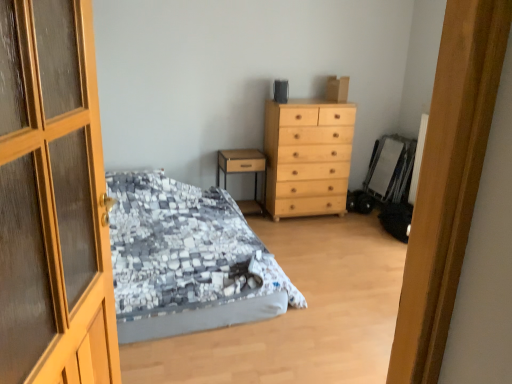
Where is `textured gray bed at center`? textured gray bed at center is located at coordinates (187, 260).

Find the location of a particular element. The image size is (512, 384). wooden nightstand at center is located at coordinates (243, 172).

The height and width of the screenshot is (384, 512). What do you see at coordinates (243, 172) in the screenshot?
I see `wooden nightstand at center` at bounding box center [243, 172].

Where is `light wood/texture chest of drawers at center`? This screenshot has width=512, height=384. light wood/texture chest of drawers at center is located at coordinates (307, 158).

Can you confirm if textured gray bed at center is thinner than wooden nightstand at center?

Incorrect, the width of textured gray bed at center is not less than that of wooden nightstand at center.

Does textured gray bed at center have a greater height compared to wooden nightstand at center?

Yes, textured gray bed at center is taller than wooden nightstand at center.

Is the surface of textured gray bed at center in direct contact with wooden nightstand at center?

There is a gap between textured gray bed at center and wooden nightstand at center.

Consider the image. Is textured gray bed at center at the left side of wooden nightstand at center?

Correct, you'll find textured gray bed at center to the left of wooden nightstand at center.

From a real-world perspective, is wooden nightstand at center physically located above or below light wood/texture chest of drawers at center?

wooden nightstand at center is below light wood/texture chest of drawers at center.

From the image's perspective, which one is positioned higher, wooden nightstand at center or light wood/texture chest of drawers at center?

From the image's view, light wood/texture chest of drawers at center is above.

Considering the positions of points (255, 158) and (286, 181), is point (255, 158) farther from camera compared to point (286, 181)?

That is True.

Can we say wooden nightstand at center lies outside light wood/texture chest of drawers at center?

wooden nightstand at center lies outside light wood/texture chest of drawers at center's area.

Locate an element on the screen. The image size is (512, 384). door on the left of light wood/texture chest of drawers at center is located at coordinates (52, 200).

Does wooden door at left lie in front of light wood/texture chest of drawers at center?

Yes, the depth of wooden door at left is less than that of light wood/texture chest of drawers at center.

Considering the relative sizes of wooden door at left and light wood/texture chest of drawers at center in the image provided, is wooden door at left taller than light wood/texture chest of drawers at center?

Correct, wooden door at left is much taller as light wood/texture chest of drawers at center.

Considering the positions of point (313, 155) and point (225, 158), is point (313, 155) closer or farther from the camera than point (225, 158)?

Point (313, 155) appears to be closer to the viewer than point (225, 158).

Can you confirm if light wood/texture chest of drawers at center is thinner than wooden nightstand at center?

Incorrect, the width of light wood/texture chest of drawers at center is not less than that of wooden nightstand at center.

Is light wood/texture chest of drawers at center facing away from wooden nightstand at center?

No, light wood/texture chest of drawers at center is not facing the opposite direction of wooden nightstand at center.

Does wooden door at left have a smaller size compared to textured gray bed at center?

Yes, wooden door at left is smaller than textured gray bed at center.

In the scene shown: Does wooden door at left appear on the right side of textured gray bed at center?

Incorrect, wooden door at left is not on the right side of textured gray bed at center.

Is wooden nightstand at center oriented away from textured gray bed at center?

Yes, wooden nightstand at center is facing away from textured gray bed at center.

Is wooden nightstand at center touching textured gray bed at center?

They are not placed beside each other.

In the image, is wooden nightstand at center on the left side or the right side of textured gray bed at center?

Clearly, wooden nightstand at center is on the right of textured gray bed at center in the image.

From the image's perspective, which one is positioned higher, wooden nightstand at center or textured gray bed at center?

wooden nightstand at center, from the image's perspective.

Between textured gray bed at center and wooden door at left, which one is positioned in front?

wooden door at left is more forward.

How different are the orientations of textured gray bed at center and wooden door at left in degrees?

textured gray bed at center and wooden door at left are facing 75.8 degrees away from each other.

Locate an element on the screen. Image resolution: width=512 pixels, height=384 pixels. bed on the right of wooden door at left is located at coordinates (187, 260).

Considering the sizes of textured gray bed at center and wooden door at left in the image, is textured gray bed at center bigger or smaller than wooden door at left?

In the image, textured gray bed at center appears to be larger than wooden door at left.

Identify the location of nightstand above the textured gray bed at center (from a real-world perspective). The image size is (512, 384). (243, 172).

This screenshot has width=512, height=384. What are the coordinates of `nightstand located underneath the light wood/texture chest of drawers at center (from a real-world perspective)` in the screenshot? It's located at (243, 172).

From the image, which object appears to be farther from textured gray bed at center, wooden door at left or wooden nightstand at center?

The object further to textured gray bed at center is wooden door at left.

Considering their positions, is wooden nightstand at center positioned closer to wooden door at left than light wood/texture chest of drawers at center?

The object closer to wooden door at left is light wood/texture chest of drawers at center.

From the image, which object appears to be nearer to wooden nightstand at center, textured gray bed at center or light wood/texture chest of drawers at center?

Based on the image, light wood/texture chest of drawers at center appears to be nearer to wooden nightstand at center.

Estimate the real-world distances between objects in this image. Which object is further from textured gray bed at center, wooden nightstand at center or light wood/texture chest of drawers at center?

Among the two, wooden nightstand at center is located further to textured gray bed at center.

From the image, which object appears to be nearer to textured gray bed at center, light wood/texture chest of drawers at center or wooden door at left?

light wood/texture chest of drawers at center is positioned closer to the anchor textured gray bed at center.

Considering their positions, is wooden door at left positioned closer to light wood/texture chest of drawers at center than textured gray bed at center?

textured gray bed at center is positioned closer to the anchor light wood/texture chest of drawers at center.

Considering their positions, is wooden nightstand at center positioned further to wooden door at left than textured gray bed at center?

Among the two, wooden nightstand at center is located further to wooden door at left.

Which object lies further to the anchor point textured gray bed at center, light wood/texture chest of drawers at center or wooden nightstand at center?

wooden nightstand at center lies further to textured gray bed at center than the other object.

The width and height of the screenshot is (512, 384). I want to click on the chest of drawers positioned between wooden door at left and wooden nightstand at center from near to far, so click(307, 158).

Identify the location of the chest of drawers located between textured gray bed at center and wooden nightstand at center in the depth direction. The height and width of the screenshot is (384, 512). (307, 158).

The width and height of the screenshot is (512, 384). I want to click on bed between wooden door at left and wooden nightstand at center in the front-back direction, so click(x=187, y=260).

Where is `bed between wooden door at left and light wood/texture chest of drawers at center in the front-back direction`? Image resolution: width=512 pixels, height=384 pixels. bed between wooden door at left and light wood/texture chest of drawers at center in the front-back direction is located at coordinates (187, 260).